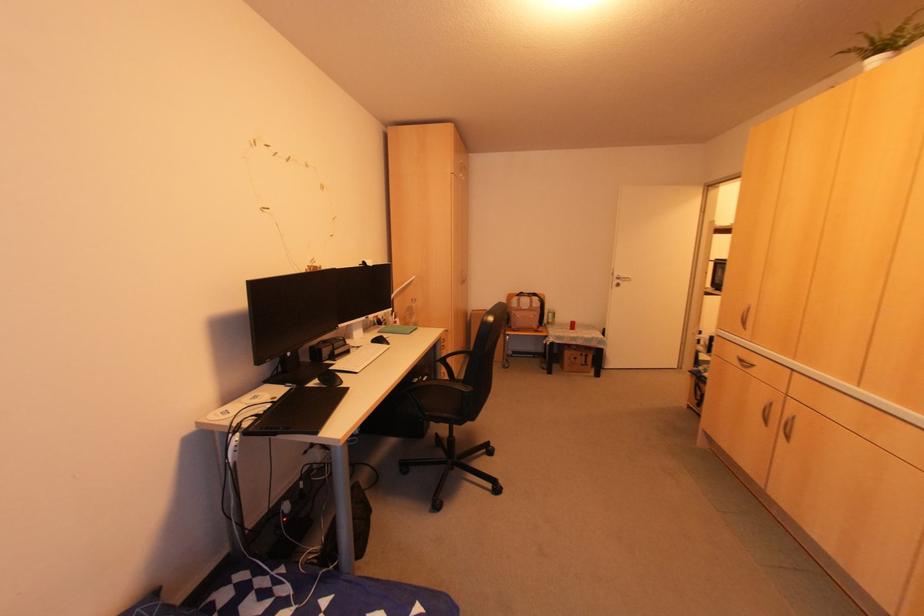
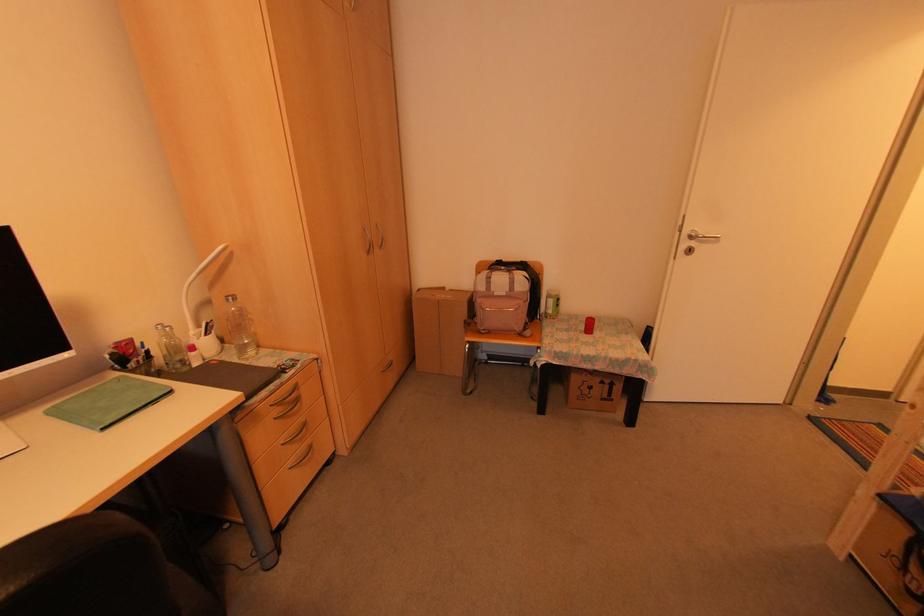
Find the pixel in the second image that matches the point at 410,301 in the first image.

(225, 300)